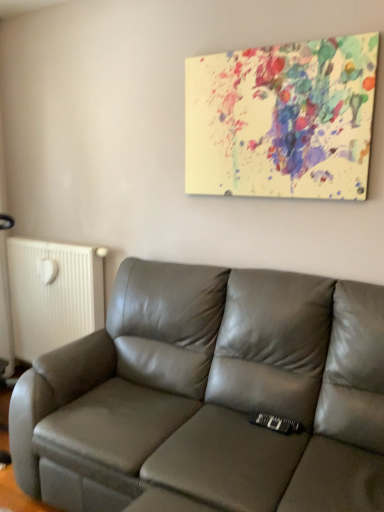
Question: From the image's perspective, would you say paint splatter canvas at upper center is positioned over satin gray leather couch at center?

Choices:
 (A) no
 (B) yes

Answer: (B)

Question: Is paint splatter canvas at upper center closer to the viewer compared to satin gray leather couch at center?

Choices:
 (A) no
 (B) yes

Answer: (A)

Question: From the image's perspective, would you say paint splatter canvas at upper center is shown under satin gray leather couch at center?

Choices:
 (A) no
 (B) yes

Answer: (A)

Question: Is paint splatter canvas at upper center facing towards satin gray leather couch at center?

Choices:
 (A) yes
 (B) no

Answer: (B)

Question: Can you confirm if paint splatter canvas at upper center is thinner than satin gray leather couch at center?

Choices:
 (A) yes
 (B) no

Answer: (A)

Question: Is white matte radiator at left taller or shorter than satin gray leather couch at center?

Choices:
 (A) short
 (B) tall

Answer: (A)

Question: Do you think white matte radiator at left is within satin gray leather couch at center, or outside of it?

Choices:
 (A) outside
 (B) inside

Answer: (A)

Question: Visually, is white matte radiator at left positioned to the left or to the right of satin gray leather couch at center?

Choices:
 (A) right
 (B) left

Answer: (B)

Question: From the image's perspective, is white matte radiator at left positioned above or below satin gray leather couch at center?

Choices:
 (A) above
 (B) below

Answer: (A)

Question: Choose the correct answer: Is paint splatter canvas at upper center inside satin gray leather couch at center or outside it?

Choices:
 (A) outside
 (B) inside

Answer: (A)

Question: Based on their positions, is paint splatter canvas at upper center located to the left or right of satin gray leather couch at center?

Choices:
 (A) left
 (B) right

Answer: (B)

Question: Is point (241, 162) closer or farther from the camera than point (336, 305)?

Choices:
 (A) closer
 (B) farther

Answer: (B)

Question: Relative to satin gray leather couch at center, is paint splatter canvas at upper center in front or behind?

Choices:
 (A) front
 (B) behind

Answer: (B)

Question: Is point (87, 414) closer or farther from the camera than point (188, 141)?

Choices:
 (A) farther
 (B) closer

Answer: (B)

Question: Considering the positions of satin gray leather couch at center and paint splatter canvas at upper center in the image, is satin gray leather couch at center bigger or smaller than paint splatter canvas at upper center?

Choices:
 (A) big
 (B) small

Answer: (A)